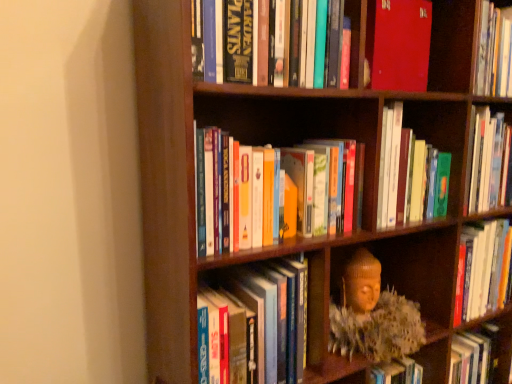
At what (x,y) coordinates should I click in order to perform the action: click on hardcover book at center, the fifth book in the top-to-bottom sequence. Please return your answer as a coordinate pair (x, y). Looking at the image, I should click on (259, 321).

The image size is (512, 384). Describe the element at coordinates (398, 44) in the screenshot. I see `hardcover books at upper center, the 2th book viewed from the top` at that location.

Locate an element on the screen. hardcover books at center, the second book when ordered from bottom to top is located at coordinates (319, 190).

You are a GUI agent. You are given a task and a screenshot of the screen. Output one action in this format:
    pyautogui.click(x=<x>, y=<y>)
    Task: Click on the hardcover book at center, the fifth book in the top-to-bottom sequence
    This screenshot has width=512, height=384.
    Given the screenshot: What is the action you would take?
    pyautogui.click(x=259, y=321)

Between point (385, 88) and point (419, 209), which one is positioned behind?

Point (419, 209)

From the hardcover books at center, which ranks as the 3th book in bottom-to-top order, count 3rd books forward and point to it. Please provide its 2D coordinates.

[(398, 44)]

From a real-world perspective, who is located higher, hardcover books at upper center, the 2th book viewed from the top, or hardcover books at center, the 3th book in the top-to-bottom sequence?

In real-world perspective, hardcover books at upper center, the 2th book viewed from the top, is above.

Between hardcover books at upper center, placed as the fourth book when sorted from bottom to top, and hardcover books at center, the 3th book in the top-to-bottom sequence, which one has less height?

hardcover books at upper center, placed as the fourth book when sorted from bottom to top, is shorter.

Is hardcover books at upper center, placed as the fourth book when sorted from bottom to top, facing away from hardcover book at center, the first book positioned from the bottom?

No.

From a real-world perspective, who is located higher, hardcover books at upper center, the 2th book viewed from the top, or hardcover book at center, the first book positioned from the bottom?

hardcover books at upper center, the 2th book viewed from the top, is physically above.

Is hardcover books at upper center, the 2th book viewed from the top, further to the viewer compared to hardcover book at center, the first book positioned from the bottom?

No, hardcover books at upper center, the 2th book viewed from the top, is closer to the viewer.

Is hardcover book at center, the first book positioned from the bottom, not close to matte red book at upper center, which is counted as the first book, starting from the top?

No.

Does hardcover book at center, the first book positioned from the bottom, have a greater height compared to matte red book at upper center, which is counted as the first book, starting from the top?

Correct, hardcover book at center, the first book positioned from the bottom, is much taller as matte red book at upper center, which is counted as the first book, starting from the top.

From the image's perspective, relative to matte red book at upper center, marked as the 5th book in a bottom-to-top arrangement, is hardcover book at center, the first book positioned from the bottom, above or below?

Clearly, from the image's perspective, hardcover book at center, the first book positioned from the bottom, is below matte red book at upper center, marked as the 5th book in a bottom-to-top arrangement.

From a real-world perspective, is matte red book at upper center, marked as the 5th book in a bottom-to-top arrangement, above or below hardcover books at upper center, the 2th book viewed from the top?

matte red book at upper center, marked as the 5th book in a bottom-to-top arrangement, is above hardcover books at upper center, the 2th book viewed from the top.

From the image's perspective, is matte red book at upper center, which is counted as the first book, starting from the top, on top of hardcover books at upper center, the 2th book viewed from the top?

Yes, from the image's perspective, matte red book at upper center, which is counted as the first book, starting from the top, is on top of hardcover books at upper center, the 2th book viewed from the top.

Measure the distance from matte red book at upper center, marked as the 5th book in a bottom-to-top arrangement, to hardcover books at upper center, placed as the fourth book when sorted from bottom to top.

A distance of 0.47 centimeters exists between matte red book at upper center, marked as the 5th book in a bottom-to-top arrangement, and hardcover books at upper center, placed as the fourth book when sorted from bottom to top.

Consider the image. How many degrees apart are the facing directions of matte red book at upper center, marked as the 5th book in a bottom-to-top arrangement, and hardcover books at upper center, placed as the fourth book when sorted from bottom to top?

The angle between the facing direction of matte red book at upper center, marked as the 5th book in a bottom-to-top arrangement, and the facing direction of hardcover books at upper center, placed as the fourth book when sorted from bottom to top, is 4.55 degrees.

Can you confirm if matte red book at upper center, which is counted as the first book, starting from the top, is thinner than hardcover books at center, the 3th book in the top-to-bottom sequence?

Yes, matte red book at upper center, which is counted as the first book, starting from the top, is thinner than hardcover books at center, the 3th book in the top-to-bottom sequence.

In the scene shown: From the image's perspective, which one is positioned lower, matte red book at upper center, marked as the 5th book in a bottom-to-top arrangement, or hardcover books at center, which ranks as the 3th book in bottom-to-top order?

hardcover books at center, which ranks as the 3th book in bottom-to-top order.

Based on the photo, is hardcover books at center, which ranks as the 3th book in bottom-to-top order, inside matte red book at upper center, which is counted as the first book, starting from the top?

No, matte red book at upper center, which is counted as the first book, starting from the top, does not contain hardcover books at center, which ranks as the 3th book in bottom-to-top order.

Can you confirm if matte red book at upper center, marked as the 5th book in a bottom-to-top arrangement, is positioned to the right of hardcover books at center, the 3th book in the top-to-bottom sequence?

No.

Can we say hardcover book at center, the first book positioned from the bottom, lies outside wooden bookcase at center?

No, hardcover book at center, the first book positioned from the bottom, is not outside of wooden bookcase at center.

Who is taller, hardcover book at center, the fifth book in the top-to-bottom sequence, or wooden bookcase at center?

Standing taller between the two is wooden bookcase at center.

Find the location of a particular element. Image resolution: width=512 pixels, height=384 pixels. bookcase located in front of the hardcover book at center, the first book positioned from the bottom is located at coordinates (287, 144).

Based on their sizes in the image, would you say hardcover book at center, the fifth book in the top-to-bottom sequence, is bigger or smaller than wooden bookcase at center?

Clearly, hardcover book at center, the fifth book in the top-to-bottom sequence, is smaller in size than wooden bookcase at center.

From a real-world perspective, is hardcover books at center, arranged as the 4th book when viewed from the top, positioned above or below hardcover books at center, which ranks as the 3th book in bottom-to-top order?

Clearly, from a real-world perspective, hardcover books at center, arranged as the 4th book when viewed from the top, is below hardcover books at center, which ranks as the 3th book in bottom-to-top order.

Who is smaller, hardcover books at center, the second book when ordered from bottom to top, or hardcover books at center, the 3th book in the top-to-bottom sequence?

With smaller size is hardcover books at center, the second book when ordered from bottom to top.

Is hardcover books at center, the second book when ordered from bottom to top, aimed at hardcover books at center, which ranks as the 3th book in bottom-to-top order?

No, hardcover books at center, the second book when ordered from bottom to top, does not turn towards hardcover books at center, which ranks as the 3th book in bottom-to-top order.

Identify the location of the 3rd book behind the hardcover books at upper center, the 2th book viewed from the top. The image size is (512, 384). (409, 174).

You are a GUI agent. You are given a task and a screenshot of the screen. Output one action in this format:
    pyautogui.click(x=<x>, y=<y>)
    Task: Click on the 3rd book directly beneath the hardcover books at upper center, the 2th book viewed from the top (from a real-world perspective)
    The width and height of the screenshot is (512, 384).
    Given the screenshot: What is the action you would take?
    pyautogui.click(x=259, y=321)

In the scene shown: Based on their spatial positions, is hardcover book at center, the first book positioned from the bottom, or hardcover books at center, the second book when ordered from bottom to top, closer to matte red book at upper center, which is counted as the first book, starting from the top?

hardcover books at center, the second book when ordered from bottom to top.

Considering their positions, is matte red book at upper center, which is counted as the first book, starting from the top, positioned closer to hardcover books at center, arranged as the 4th book when viewed from the top, than hardcover books at upper center, the 2th book viewed from the top?

Among the two, hardcover books at upper center, the 2th book viewed from the top, is located nearer to hardcover books at center, arranged as the 4th book when viewed from the top.

From the image, which object appears to be farther from hardcover book at center, the first book positioned from the bottom, hardcover books at center, the 3th book in the top-to-bottom sequence, or hardcover books at upper center, placed as the fourth book when sorted from bottom to top?

The object further to hardcover book at center, the first book positioned from the bottom, is hardcover books at upper center, placed as the fourth book when sorted from bottom to top.

When comparing their distances from hardcover books at upper center, placed as the fourth book when sorted from bottom to top, does matte red book at upper center, which is counted as the first book, starting from the top, or hardcover books at center, arranged as the 4th book when viewed from the top, seem closer?

The object closer to hardcover books at upper center, placed as the fourth book when sorted from bottom to top, is matte red book at upper center, which is counted as the first book, starting from the top.

From the picture: Based on their spatial positions, is hardcover books at center, the 3th book in the top-to-bottom sequence, or hardcover books at center, arranged as the 4th book when viewed from the top, closer to hardcover book at center, the fifth book in the top-to-bottom sequence?

hardcover books at center, arranged as the 4th book when viewed from the top, is closer to hardcover book at center, the fifth book in the top-to-bottom sequence.

From the image, which object appears to be farther from hardcover book at center, the fifth book in the top-to-bottom sequence, hardcover books at upper center, the 2th book viewed from the top, or hardcover books at center, arranged as the 4th book when viewed from the top?

hardcover books at upper center, the 2th book viewed from the top, is further to hardcover book at center, the fifth book in the top-to-bottom sequence.

Based on their spatial positions, is hardcover books at center, which ranks as the 3th book in bottom-to-top order, or matte red book at upper center, which is counted as the first book, starting from the top, further from hardcover book at center, the first book positioned from the bottom?

matte red book at upper center, which is counted as the first book, starting from the top, is positioned further to the anchor hardcover book at center, the first book positioned from the bottom.

Looking at the image, which one is located further to matte red book at upper center, which is counted as the first book, starting from the top, hardcover books at center, which ranks as the 3th book in bottom-to-top order, or hardcover books at upper center, placed as the fourth book when sorted from bottom to top?

hardcover books at center, which ranks as the 3th book in bottom-to-top order, is further to matte red book at upper center, which is counted as the first book, starting from the top.

Locate an element on the screen. This screenshot has height=384, width=512. bookcase situated between hardcover books at center, the second book when ordered from bottom to top, and hardcover books at center, which ranks as the 3th book in bottom-to-top order, from left to right is located at coordinates (287, 144).

Where is `bookcase between matte red book at upper center, marked as the 5th book in a bottom-to-top arrangement, and hardcover book at center, the first book positioned from the bottom, in the vertical direction`? The image size is (512, 384). bookcase between matte red book at upper center, marked as the 5th book in a bottom-to-top arrangement, and hardcover book at center, the first book positioned from the bottom, in the vertical direction is located at coordinates (287, 144).

At what (x,y) coordinates should I click in order to perform the action: click on bookcase between hardcover books at upper center, placed as the fourth book when sorted from bottom to top, and hardcover book at center, the first book positioned from the bottom, in the vertical direction. Please return your answer as a coordinate pair (x, y). Looking at the image, I should click on (287, 144).

Identify the location of bookcase between hardcover book at center, the fifth book in the top-to-bottom sequence, and hardcover books at center, the 3th book in the top-to-bottom sequence. The image size is (512, 384). (287, 144).